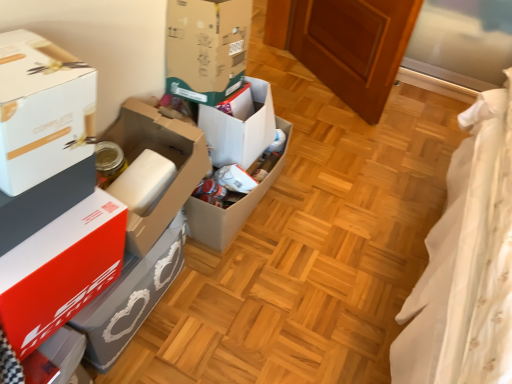
Question: Considering the positions of point pos(237,84) and point pos(161,198), is point pos(237,84) closer or farther from the camera than point pos(161,198)?

Choices:
 (A) farther
 (B) closer

Answer: (A)

Question: From the image's perspective, is cardboard box at center, the 4th box from the front, positioned above or below white cardboard box at left, which is the 4th box from back to front?

Choices:
 (A) above
 (B) below

Answer: (A)

Question: Which is nearer to the red matte box at left, the second box in the front-to-back sequence?

Choices:
 (A) cardboard box at center, the fifth box when ordered from front to back
 (B) white cardboard box at left, which is counted as the first box, starting from the front
 (C) white cardboard box at left, which is the 4th box from back to front
 (D) white cardboard box at center, arranged as the first box when viewed from the back
 (E) cardboard box at center, the 4th box from the front

Answer: (C)

Question: Estimate the real-world distances between objects in this image. Which object is closer to the white cardboard box at left, positioned as the 3th box in front-to-back order?

Choices:
 (A) cardboard box at center, the 4th box from the front
 (B) cardboard box at center, the fifth box when ordered from front to back
 (C) white cardboard box at left, which is counted as the first box, starting from the front
 (D) white cardboard box at center, arranged as the first box when viewed from the back
 (E) red matte box at left, arranged as the 5th box when viewed from the back

Answer: (E)